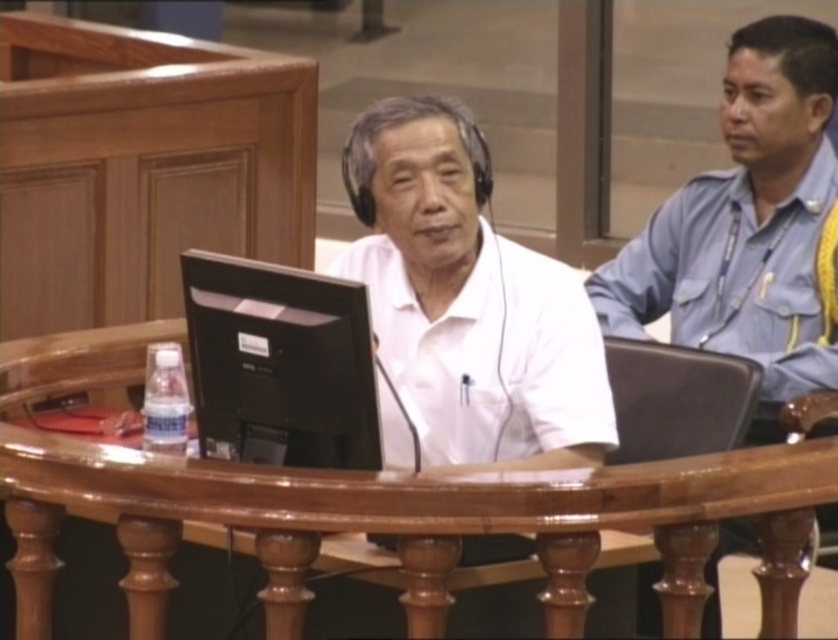
Between white matte shirt at center and black matte monitor at center, which one appears on the right side from the viewer's perspective?

white matte shirt at center

Which of these two, white matte shirt at center or black matte monitor at center, stands shorter?

black matte monitor at center

Is point (464, 419) farther from camera compared to point (295, 381)?

Yes, point (464, 419) is behind point (295, 381).

What are the coordinates of `white matte shirt at center` in the screenshot? It's located at (464, 304).